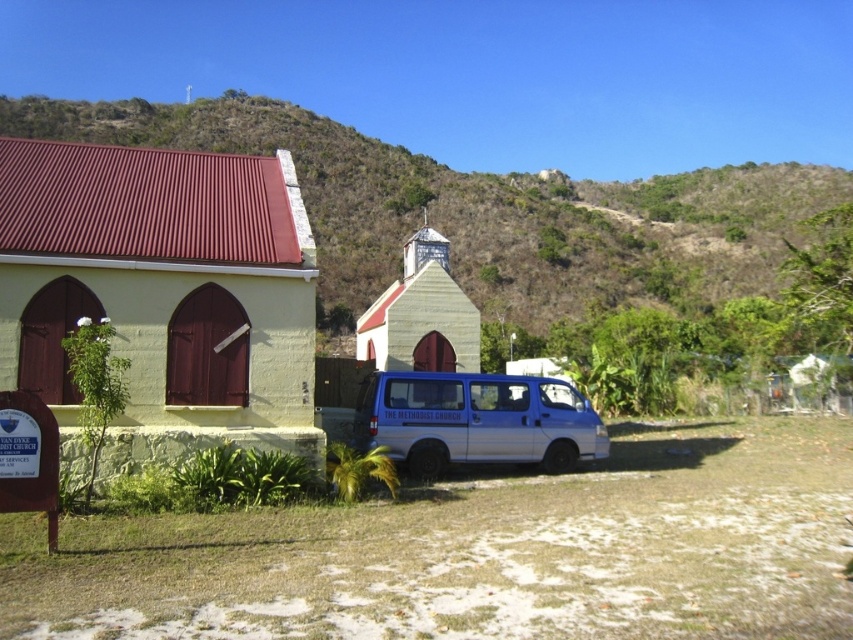
Is green grassy hillside at upper center smaller than blue metallic van at center?

No.

Who is more distant from viewer, (358, 212) or (503, 442)?

Point (358, 212)

You are a GUI agent. You are given a task and a screenshot of the screen. Output one action in this format:
    pyautogui.click(x=<x>, y=<y>)
    Task: Click on the green grassy hillside at upper center
    The height and width of the screenshot is (640, 853).
    Given the screenshot: What is the action you would take?
    pyautogui.click(x=486, y=211)

Is blue metallic van at center thinner than wooden chapel at center?

Correct, blue metallic van at center's width is less than wooden chapel at center's.

Is blue metallic van at center to the left of wooden chapel at center from the viewer's perspective?

In fact, blue metallic van at center is to the right of wooden chapel at center.

Between point (486, 458) and point (405, 280), which one is positioned behind?

Positioned behind is point (405, 280).

Where is `blue metallic van at center`? Image resolution: width=853 pixels, height=640 pixels. blue metallic van at center is located at coordinates (474, 420).

Can you confirm if yellow matte church at center is shorter than wooden chapel at center?

Yes.

Where is `yellow matte church at center`? yellow matte church at center is located at coordinates (160, 292).